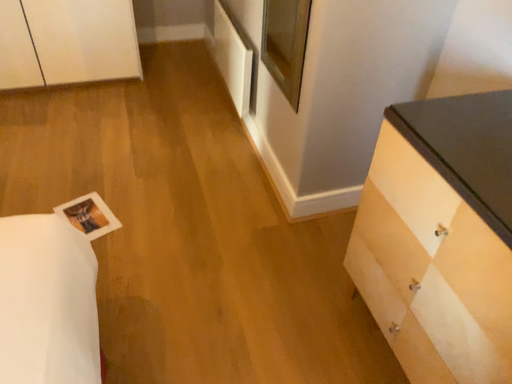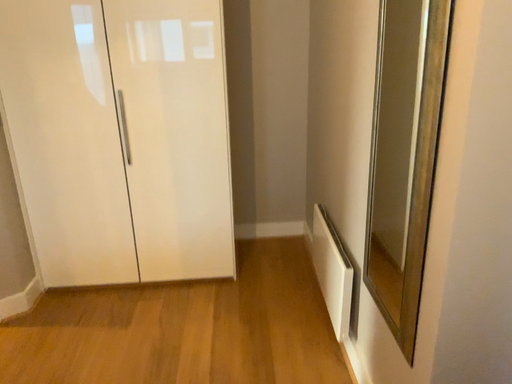
Question: How did the camera likely rotate when shooting the video?

Choices:
 (A) rotated downward
 (B) rotated upward

Answer: (B)